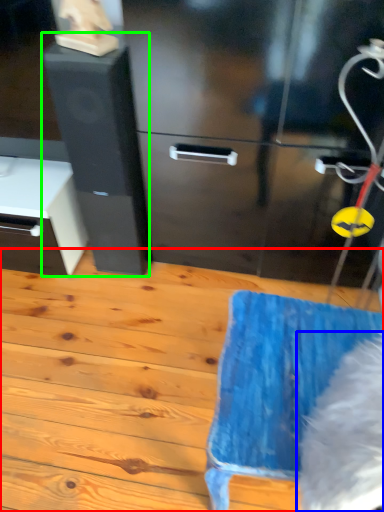
Question: Considering the real-world distances, which object is closest to wood (highlighted by a red box)? animal (highlighted by a blue box) or file cabinet (highlighted by a green box).

Choices:
 (A) animal
 (B) file cabinet

Answer: (B)